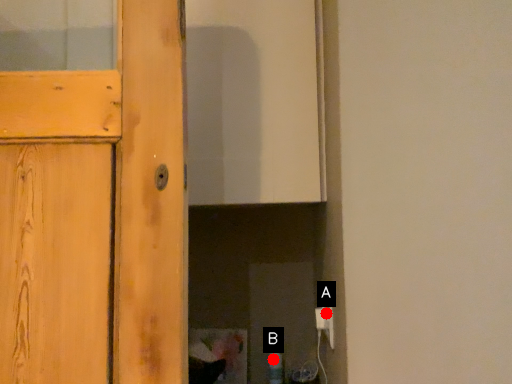
Question: Two points are circled on the image, labeled by A and B beside each circle. Which point is further to the camera?

Choices:
 (A) A is further
 (B) B is further

Answer: (B)